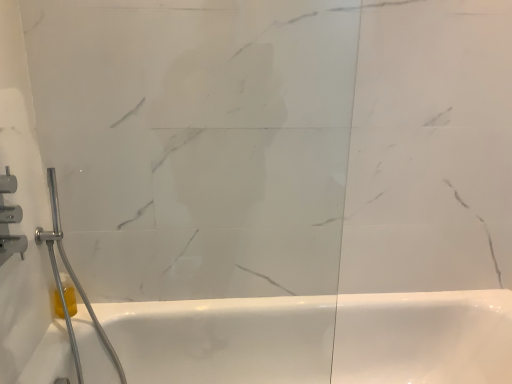
Question: Should I look upward or downward to see transparent glass door at center?

Choices:
 (A) up
 (B) down

Answer: (B)

Question: From a real-world perspective, is brushed metal shower at left, which is the second shower in front-to-back order, located beneath brushed metal shower at left, the 1th shower from the front?

Choices:
 (A) no
 (B) yes

Answer: (B)

Question: Can you confirm if brushed metal shower at left, which is the second shower in front-to-back order, is taller than brushed metal shower at left, the 1th shower from the front?

Choices:
 (A) no
 (B) yes

Answer: (B)

Question: Is brushed metal shower at left, which appears as the first shower when viewed from the back, outside of brushed metal shower at left, the 1th shower from the front?

Choices:
 (A) no
 (B) yes

Answer: (B)

Question: From the image's perspective, is brushed metal shower at left, which is the second shower in front-to-back order, on top of brushed metal shower at left, positioned as the 2th shower in back-to-front order?

Choices:
 (A) no
 (B) yes

Answer: (A)

Question: Is brushed metal shower at left, which appears as the first shower when viewed from the back, aimed at brushed metal shower at left, the 1th shower from the front?

Choices:
 (A) yes
 (B) no

Answer: (B)

Question: Would you say brushed metal shower at left, which appears as the first shower when viewed from the back, is a long distance from brushed metal shower at left, positioned as the 2th shower in back-to-front order?

Choices:
 (A) yes
 (B) no

Answer: (B)

Question: Is brushed metal shower at left, which appears as the first shower when viewed from the back, positioned with its back to yellow translucent soap at lower left?

Choices:
 (A) no
 (B) yes

Answer: (A)

Question: Is brushed metal shower at left, which appears as the first shower when viewed from the back, facing towards yellow translucent soap at lower left?

Choices:
 (A) yes
 (B) no

Answer: (B)

Question: Does brushed metal shower at left, which is the second shower in front-to-back order, contain yellow translucent soap at lower left?

Choices:
 (A) no
 (B) yes

Answer: (A)

Question: Can you confirm if brushed metal shower at left, which is the second shower in front-to-back order, is wider than yellow translucent soap at lower left?

Choices:
 (A) yes
 (B) no

Answer: (A)

Question: Does brushed metal shower at left, which appears as the first shower when viewed from the back, have a lesser width compared to yellow translucent soap at lower left?

Choices:
 (A) yes
 (B) no

Answer: (B)

Question: Does brushed metal shower at left, which appears as the first shower when viewed from the back, have a larger size compared to yellow translucent soap at lower left?

Choices:
 (A) yes
 (B) no

Answer: (A)

Question: From a real-world perspective, does transparent glass door at center stand above brushed metal shower at left, positioned as the 2th shower in back-to-front order?

Choices:
 (A) no
 (B) yes

Answer: (B)